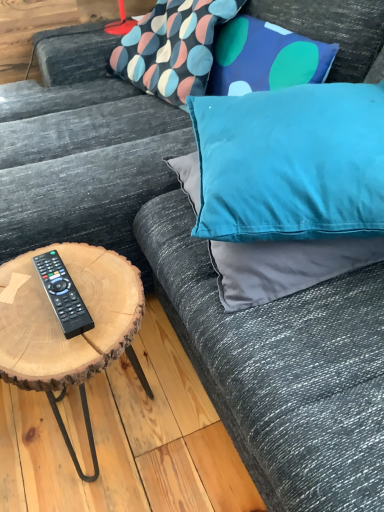
Question: Visually, is teal fabric pillow at upper right, which is counted as the first pillow, starting from the bottom, positioned to the left or to the right of teal satin pillow at upper right, which is the second pillow in bottom-to-top order?

Choices:
 (A) right
 (B) left

Answer: (B)

Question: Considering the positions of point (268, 268) and point (271, 164), is point (268, 268) closer or farther from the camera than point (271, 164)?

Choices:
 (A) closer
 (B) farther

Answer: (B)

Question: Based on their relative distances, which object is farther from the velvet blue pillow at upper right?

Choices:
 (A) black plastic remote at lower left
 (B) textured fabric pillow at upper center, which ranks as the first pillow in top-to-bottom order
 (C) teal satin pillow at upper right, which appears as the second pillow when viewed from the top
 (D) teal fabric pillow at upper right, the third pillow positioned from the top
 (E) natural wood coffee table at left

Answer: (B)

Question: Based on their relative distances, which object is nearer to the teal fabric pillow at upper right, which is counted as the first pillow, starting from the bottom?

Choices:
 (A) velvet blue pillow at upper right
 (B) teal satin pillow at upper right, which is the second pillow in bottom-to-top order
 (C) textured fabric pillow at upper center, which ranks as the first pillow in top-to-bottom order
 (D) natural wood coffee table at left
 (E) black plastic remote at lower left

Answer: (A)